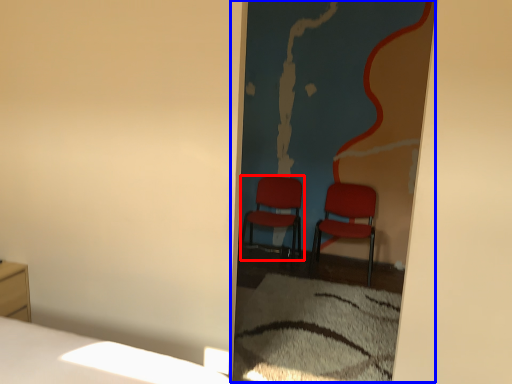
Question: Which object appears farthest to the camera in this image, chair (highlighted by a red box) or screen door (highlighted by a blue box)?

Choices:
 (A) chair
 (B) screen door

Answer: (A)